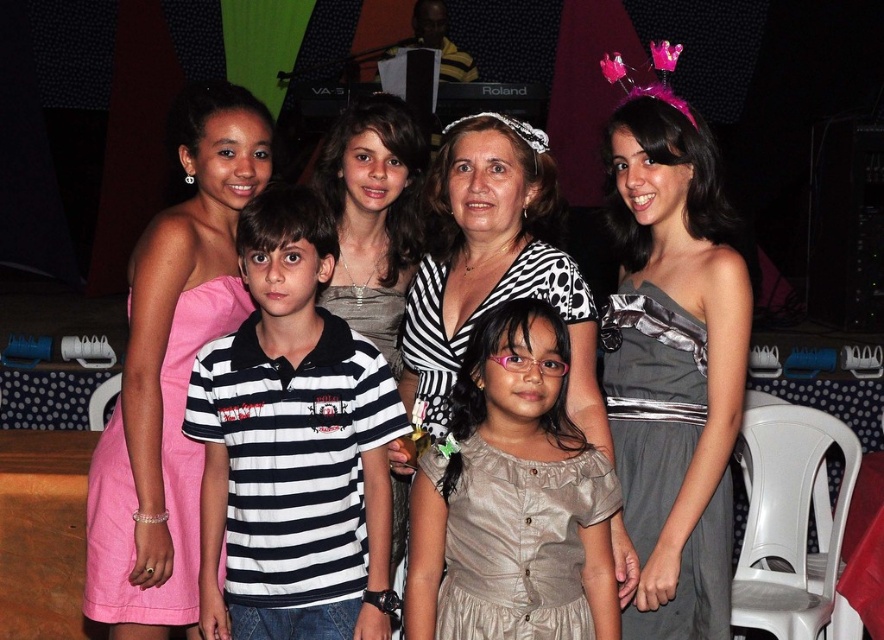
You are a photographer trying to adjust the lighting for a group photo. You have a spotlight that can cover a radius of 30 inches. The spotlight is currently pointed at the pink fabric tiara at center. Will the satin gray dress at lower right be illuminated by the spotlight?

The satin gray dress at lower right is 32.37 inches away from the pink fabric tiara at center. Since the spotlight has a 30 inch radius, the distance between them is greater than the spotlight radius. Therefore, the satin gray dress at lower right will not be illuminated by the spotlight.

You are a photographer trying to capture a closeup of the pink fabric tiara at center and the satin gray dress at lower right. Which object should you zoom in on first to ensure it fits in the frame?

The satin gray dress at lower right is smaller than the pink fabric tiara at center, so you should zoom in on the pink fabric tiara at center first to ensure it fits in the frame before adjusting for the smaller dress.

You are a photographer trying to adjust the lighting for the group photo. You need to ensure both the black striped shirt at center and the matte silver dress at center are well lit. Which one is on the left side of the other?

The black striped shirt at center is positioned on the left side of matte silver dress at center.